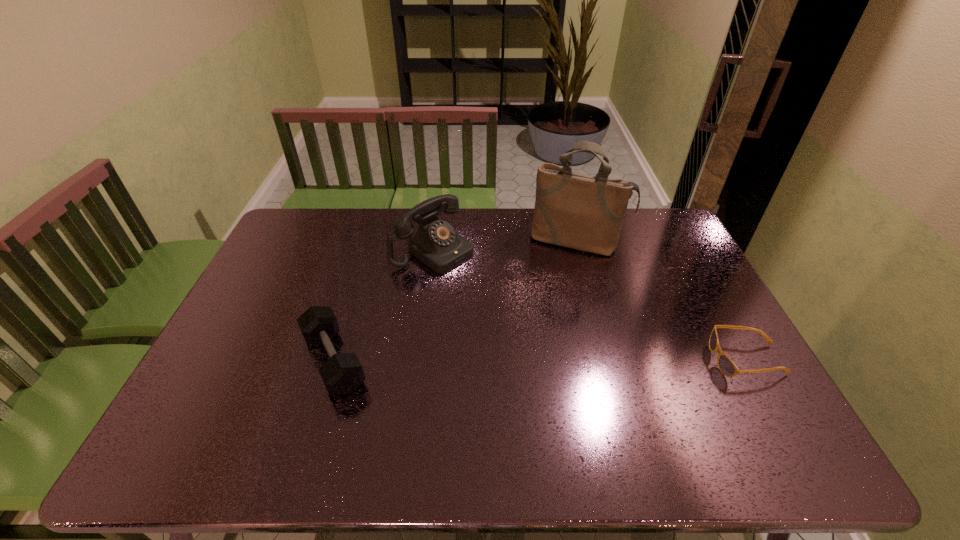
The width and height of the screenshot is (960, 540). Identify the location of free space located on the front-facing side of the shoulder bag. (560, 276).

Locate an element on the screen. The width and height of the screenshot is (960, 540). vacant area situated 0.370m on the front-facing side of the shoulder bag is located at coordinates (542, 335).

This screenshot has width=960, height=540. Identify the location of vacant space positioned 0.320m on the front-facing side of the shoulder bag. (546, 322).

Where is `vacant point located 0.150m on the dial of the telephone`? Image resolution: width=960 pixels, height=540 pixels. vacant point located 0.150m on the dial of the telephone is located at coordinates (492, 290).

You are a GUI agent. You are given a task and a screenshot of the screen. Output one action in this format:
    pyautogui.click(x=<x>, y=<y>)
    Task: Click on the free space located on the dial of the telephone
    This screenshot has height=540, width=960.
    Given the screenshot: What is the action you would take?
    pyautogui.click(x=523, y=312)

Identify the location of vacant space located 0.290m on the dial of the telephone. (525, 314).

The width and height of the screenshot is (960, 540). In order to click on shoulder bag present at the far edge in this screenshot , I will do `click(578, 211)`.

This screenshot has width=960, height=540. I want to click on telephone that is at the far edge, so click(436, 244).

Locate an element on the screen. The image size is (960, 540). object at the near edge is located at coordinates (342, 373).

I want to click on object situated at the right edge, so click(x=727, y=367).